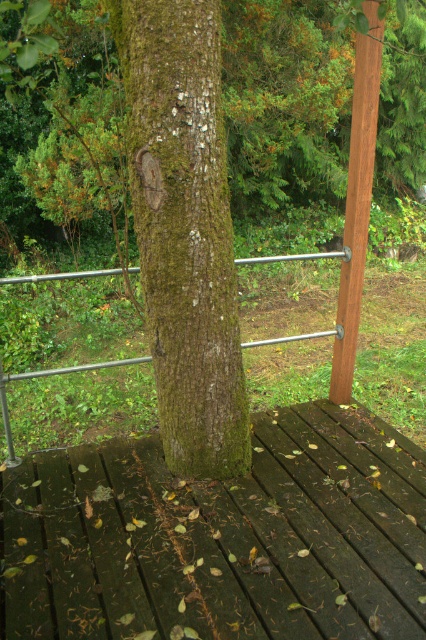
Can you confirm if dark brown wood at center is wider than metal/rustic rail at center?

Yes.

Between dark brown wood at center and metal/rustic rail at center, which one has less height?

With less height is metal/rustic rail at center.

The image size is (426, 640). What do you see at coordinates (221, 538) in the screenshot?
I see `dark brown wood at center` at bounding box center [221, 538].

Where is `dark brown wood at center`? The image size is (426, 640). dark brown wood at center is located at coordinates (221, 538).

Between green mossy bark tree at center and green rough bark tree trunk at center, which one appears on the right side from the viewer's perspective?

Positioned to the right is green rough bark tree trunk at center.

Which of these two, green mossy bark tree at center or green rough bark tree trunk at center, stands shorter?

green mossy bark tree at center is shorter.

Between point (192, 193) and point (195, 323), which one is positioned behind?

Positioned behind is point (195, 323).

This screenshot has height=640, width=426. What are the coordinates of `green mossy bark tree at center` in the screenshot? It's located at (181, 248).

Who is higher up, green rough bark tree trunk at center or metal/rustic rail at center?

Positioned higher is metal/rustic rail at center.

Is green rough bark tree trunk at center positioned at the back of metal/rustic rail at center?

No, green rough bark tree trunk at center is closer to the viewer.

Between point (167, 33) and point (311, 332), which one is positioned behind?

Positioned behind is point (311, 332).

Locate an element on the screen. green rough bark tree trunk at center is located at coordinates (184, 228).